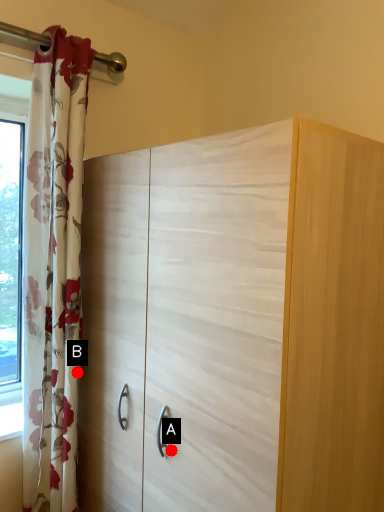
Question: Two points are circled on the image, labeled by A and B beside each circle. Which point is farther to the camera?

Choices:
 (A) A is further
 (B) B is further

Answer: (B)